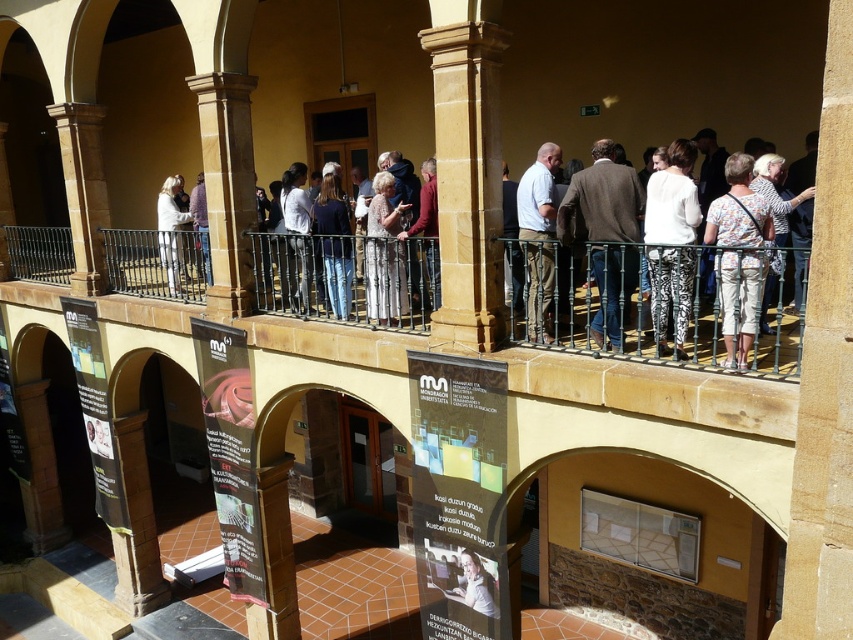
You are an architect designing a new building. You need to place a statue that requires a support structure taller than the white fabric at upper center. Can the brown stone pillar at center provide sufficient height for this purpose?

The brown stone pillar at center is much taller than the white fabric at upper center, so it can provide sufficient height for the statue requiring a support structure taller than the white fabric at upper center.

You are standing at the entrance of the building and notice both the brown stone pillar at center and the white fabric at upper center. Which object is positioned to the right of the other?

The brown stone pillar at center is to the right of the white fabric at upper center.